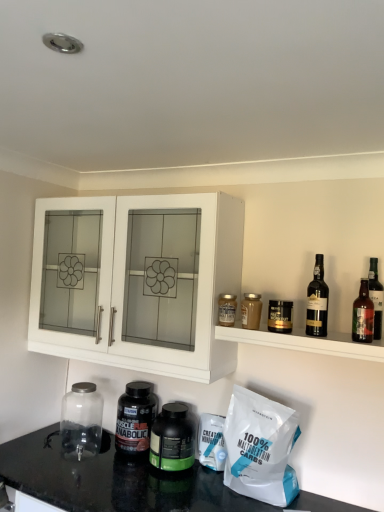
The width and height of the screenshot is (384, 512). Describe the element at coordinates (135, 418) in the screenshot. I see `black plastic bottle at lower center, which ranks as the fifth bottle in right-to-left order` at that location.

The image size is (384, 512). In order to click on matte glass shelf at upper right in this screenshot , I will do `click(305, 342)`.

What do you see at coordinates (260, 448) in the screenshot? The height and width of the screenshot is (512, 384). I see `white matte bag of 100% maltodextrin carbs at lower right` at bounding box center [260, 448].

The width and height of the screenshot is (384, 512). What do you see at coordinates (363, 315) in the screenshot?
I see `brown glass bottle at right` at bounding box center [363, 315].

This screenshot has width=384, height=512. I want to click on black plastic bottle at lower center, positioned as the 1th bottle in left-to-right order, so click(x=135, y=418).

From a real-world perspective, is translucent glass jar at shelf right, positioned as the first bottle in top-to-bottom order, physically located above or below black plastic bottle at lower center, which ranks as the 4th bottle in top-to-bottom order?

translucent glass jar at shelf right, positioned as the first bottle in top-to-bottom order, is situated higher than black plastic bottle at lower center, which ranks as the 4th bottle in top-to-bottom order, in the real world.

Is translucent glass jar at shelf right, which ranks as the second bottle in right-to-left order, facing towards black plastic bottle at lower center, positioned as the 1th bottle in left-to-right order?

No, translucent glass jar at shelf right, which ranks as the second bottle in right-to-left order, is not oriented towards black plastic bottle at lower center, positioned as the 1th bottle in left-to-right order.

Does point (241, 305) appear closer or farther from the camera than point (142, 449)?

Point (241, 305) appears to be closer to the viewer than point (142, 449).

Considering the relative sizes of white matte bag of 100% maltodextrin carbs at lower right and translucent glass jar at shelf right, positioned as the first bottle in top-to-bottom order, in the image provided, is white matte bag of 100% maltodextrin carbs at lower right wider than translucent glass jar at shelf right, positioned as the first bottle in top-to-bottom order,?

Indeed, white matte bag of 100% maltodextrin carbs at lower right has a greater width compared to translucent glass jar at shelf right, positioned as the first bottle in top-to-bottom order.

In the scene shown: Which point is more forward, (240,470) or (243,304)?

The point (240,470) is closer to the camera.

How far apart are white matte bag of 100% maltodextrin carbs at lower right and translucent glass jar at shelf right, which is the 5th bottle in bottom-to-top order?

They are 18.38 inches apart.

Based on the photo, based on their positions, is dark glass bottle at shelf right located to the left or right of matte glass jar at center, which is the second bottle from top to bottom?

In the image, dark glass bottle at shelf right appears on the right side of matte glass jar at center, which is the second bottle from top to bottom.

From a real-world perspective, is dark glass bottle at shelf right physically below matte glass jar at center, which is the second bottle from top to bottom?

No, from a real-world perspective, dark glass bottle at shelf right is not under matte glass jar at center, which is the second bottle from top to bottom.

From the image's perspective, which one is positioned lower, dark glass bottle at shelf right or matte glass jar at center, which is the third bottle from right to left?

matte glass jar at center, which is the third bottle from right to left, is shown below in the image.

Is dark glass bottle at shelf right positioned behind matte glass jar at center, which is the second bottle from top to bottom?

No.

Is transparent glass jar at lower left aimed at green matte bottle at center, the fourth bottle positioned from the right?

No, transparent glass jar at lower left is not facing towards green matte bottle at center, the fourth bottle positioned from the right.

Which point is more distant from viewer, (83, 394) or (179, 413)?

The point (83, 394) is behind.

Can you tell me how much transparent glass jar at lower left and green matte bottle at center, the 5th bottle viewed from the top, differ in facing direction?

0.000375 degrees separate the facing orientations of transparent glass jar at lower left and green matte bottle at center, the 5th bottle viewed from the top.

Considering their positions, is transparent glass jar at lower left located in front of or behind green matte bottle at center, the 5th bottle viewed from the top?

Clearly, transparent glass jar at lower left is behind green matte bottle at center, the 5th bottle viewed from the top.

You are a GUI agent. You are given a task and a screenshot of the screen. Output one action in this format:
    pyautogui.click(x=<x>, y=<y>)
    Task: Click on the 4th bottle behind the matte glass shelf at upper right, starting your count from the anchor
    
    Given the screenshot: What is the action you would take?
    pyautogui.click(x=172, y=439)

Is green matte bottle at center, the 5th bottle viewed from the top, oriented towards matte glass shelf at upper right?

No, green matte bottle at center, the 5th bottle viewed from the top, is not turned towards matte glass shelf at upper right.

Is point (172, 468) closer to viewer compared to point (235, 335)?

No, it is not.

Is green matte bottle at center, marked as the 2th bottle in a left-to-right arrangement, to the right of matte glass shelf at upper right from the viewer's perspective?

In fact, green matte bottle at center, marked as the 2th bottle in a left-to-right arrangement, is to the left of matte glass shelf at upper right.

Considering the points (258, 330) and (223, 246), which point is in front, point (258, 330) or point (223, 246)?

The point (258, 330) is closer.

From a real-world perspective, is matte glass shelf at upper right positioned under white matte cabinet at upper left based on gravity?

Correct, in the physical world, matte glass shelf at upper right is lower than white matte cabinet at upper left.

Is matte glass shelf at upper right wider or thinner than white matte cabinet at upper left?

Clearly, matte glass shelf at upper right has less width compared to white matte cabinet at upper left.

In terms of size, does matte glass shelf at upper right appear bigger or smaller than white matte cabinet at upper left?

Considering their sizes, matte glass shelf at upper right takes up less space than white matte cabinet at upper left.

Based on the photo, can you confirm if matte glass jar at center, which is the 4th bottle from bottom to top, is taller than brown glass bottle at right?

In fact, matte glass jar at center, which is the 4th bottle from bottom to top, may be shorter than brown glass bottle at right.

Would you consider matte glass jar at center, acting as the 3th bottle starting from the left, to be distant from brown glass bottle at right?

matte glass jar at center, acting as the 3th bottle starting from the left, is near brown glass bottle at right, not far away.

Is matte glass jar at center, which is the 4th bottle from bottom to top, outside of brown glass bottle at right?

matte glass jar at center, which is the 4th bottle from bottom to top, is positioned outside brown glass bottle at right.

In terms of width, does matte glass jar at center, which is the 4th bottle from bottom to top, look wider or thinner when compared to brown glass bottle at right?

matte glass jar at center, which is the 4th bottle from bottom to top, is wider than brown glass bottle at right.

Locate an element on the screen. The width and height of the screenshot is (384, 512). the 3rd bottle behind the translucent glass jar at shelf right, the fourth bottle positioned from the left, counting from the anchor's position is located at coordinates (135, 418).

Find the location of a particular element. The image size is (384, 512). the 3rd bottle above the white matte bag of 100% maltodextrin carbs at lower right (from the image's perspective) is located at coordinates (251, 311).

Estimate the real-world distances between objects in this image. Which object is closer to translucent glass jar at shelf right, which ranks as the second bottle in right-to-left order, matte glass shelf at upper right or black plastic bottle at lower center, which ranks as the 4th bottle in top-to-bottom order?

Based on the image, matte glass shelf at upper right appears to be nearer to translucent glass jar at shelf right, which ranks as the second bottle in right-to-left order.

Which object lies nearer to the anchor point white matte bag of 100% maltodextrin carbs at lower right, dark glass bottle at shelf right or matte glass jar at center, which is the second bottle from top to bottom?

Among the two, matte glass jar at center, which is the second bottle from top to bottom, is located nearer to white matte bag of 100% maltodextrin carbs at lower right.

Based on their spatial positions, is black plastic bottle at lower center, placed as the second bottle when sorted from bottom to top, or transparent glass jar at lower left further from white matte cabinet at upper left?

Among the two, transparent glass jar at lower left is located further to white matte cabinet at upper left.

Looking at the image, which one is located closer to matte glass jar at center, which is the third bottle from right to left, brown glass bottle at right or matte glass shelf at upper right?

The object closer to matte glass jar at center, which is the third bottle from right to left, is matte glass shelf at upper right.

Which object lies further to the anchor point green matte bottle at center, marked as the 2th bottle in a left-to-right arrangement, matte glass shelf at upper right or brown glass bottle at right?

brown glass bottle at right is positioned further to the anchor green matte bottle at center, marked as the 2th bottle in a left-to-right arrangement.

Considering their positions, is black plastic bottle at lower center, placed as the second bottle when sorted from bottom to top, positioned further to matte glass shelf at upper right than green matte bottle at center, marked as the 2th bottle in a left-to-right arrangement?

black plastic bottle at lower center, placed as the second bottle when sorted from bottom to top.

Considering their positions, is transparent glass jar at lower left positioned further to dark glass bottle at shelf right than black plastic bottle at lower center, positioned as the 1th bottle in left-to-right order?

transparent glass jar at lower left.

Estimate the real-world distances between objects in this image. Which object is closer to translucent glass jar at shelf right, positioned as the first bottle in top-to-bottom order, brown glass bottle at right or black plastic bottle at lower center, positioned as the 1th bottle in left-to-right order?

brown glass bottle at right lies closer to translucent glass jar at shelf right, positioned as the first bottle in top-to-bottom order, than the other object.

The width and height of the screenshot is (384, 512). Find the location of `shelf between white matte cabinet at upper left and dark glass bottle at shelf right`. shelf between white matte cabinet at upper left and dark glass bottle at shelf right is located at coordinates (305, 342).

Where is `shelf between matte glass jar at center, acting as the 3th bottle starting from the left, and white matte bag of 100% maltodextrin carbs at lower right from top to bottom`? The width and height of the screenshot is (384, 512). shelf between matte glass jar at center, acting as the 3th bottle starting from the left, and white matte bag of 100% maltodextrin carbs at lower right from top to bottom is located at coordinates (305, 342).

You are a GUI agent. You are given a task and a screenshot of the screen. Output one action in this format:
    pyautogui.click(x=<x>, y=<y>)
    Task: Click on the material between green matte bottle at center, marked as the 2th bottle in a left-to-right arrangement, and matte glass shelf at upper right, in the horizontal direction
    The width and height of the screenshot is (384, 512).
    Given the screenshot: What is the action you would take?
    pyautogui.click(x=260, y=448)

Identify the location of shelf situated between translucent glass jar at shelf right, positioned as the first bottle in top-to-bottom order, and brown glass bottle at right from left to right. (305, 342).